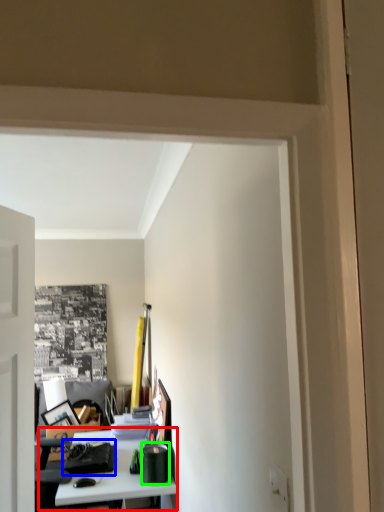
Question: Considering the real-world distances, which object is closest to table (highlighted by a red box)? stationery (highlighted by a blue box) or stationery (highlighted by a green box).

Choices:
 (A) stationery
 (B) stationery

Answer: (A)